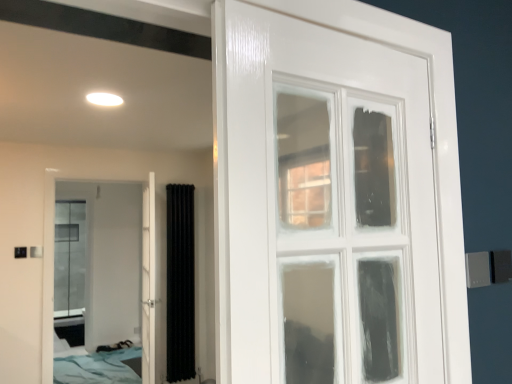
Question: Considering the relative sizes of white glossy door at center, the 2th door from the left, and blue fabric bed at lower left in the image provided, is white glossy door at center, the 2th door from the left, wider than blue fabric bed at lower left?

Choices:
 (A) yes
 (B) no

Answer: (B)

Question: Is blue fabric bed at lower left completely or partially inside white glossy door at center, the 2th door from the left?

Choices:
 (A) yes
 (B) no

Answer: (B)

Question: Does white glossy door at center, the first door positioned from the right, turn towards blue fabric bed at lower left?

Choices:
 (A) yes
 (B) no

Answer: (B)

Question: Is white glossy door at center, the 2th door from the left, to the left of blue fabric bed at lower left from the viewer's perspective?

Choices:
 (A) yes
 (B) no

Answer: (B)

Question: Is white glossy door at center, the first door positioned from the right, further to the viewer compared to blue fabric bed at lower left?

Choices:
 (A) no
 (B) yes

Answer: (A)

Question: Based on their positions, is white glossy door at left, which is the 2th door from right to left, located to the left or right of blue fabric bed at lower left?

Choices:
 (A) left
 (B) right

Answer: (B)

Question: Which is correct: white glossy door at left, which is the 2th door from right to left, is inside blue fabric bed at lower left, or outside of it?

Choices:
 (A) outside
 (B) inside

Answer: (A)

Question: In terms of size, does white glossy door at left, which is the 2th door from right to left, appear bigger or smaller than blue fabric bed at lower left?

Choices:
 (A) big
 (B) small

Answer: (B)

Question: Considering the positions of point (117, 198) and point (87, 365), is point (117, 198) closer or farther from the camera than point (87, 365)?

Choices:
 (A) closer
 (B) farther

Answer: (B)

Question: From their relative heights in the image, would you say black textured curtain at center is taller or shorter than white glossy door at center, the 2th door from the left?

Choices:
 (A) tall
 (B) short

Answer: (B)

Question: From a real-world perspective, is black textured curtain at center above or below white glossy door at center, the first door positioned from the right?

Choices:
 (A) below
 (B) above

Answer: (A)

Question: Is black textured curtain at center spatially inside white glossy door at center, the 2th door from the left, or outside of it?

Choices:
 (A) outside
 (B) inside

Answer: (A)

Question: Considering the relative positions of black textured curtain at center and white glossy door at center, the 2th door from the left, in the image provided, is black textured curtain at center to the left or to the right of white glossy door at center, the 2th door from the left,?

Choices:
 (A) right
 (B) left

Answer: (A)

Question: Considering the positions of black textured curtain at center and blue fabric bed at lower left in the image, is black textured curtain at center taller or shorter than blue fabric bed at lower left?

Choices:
 (A) tall
 (B) short

Answer: (A)

Question: Considering the positions of point (174, 200) and point (97, 370), is point (174, 200) closer or farther from the camera than point (97, 370)?

Choices:
 (A) farther
 (B) closer

Answer: (B)